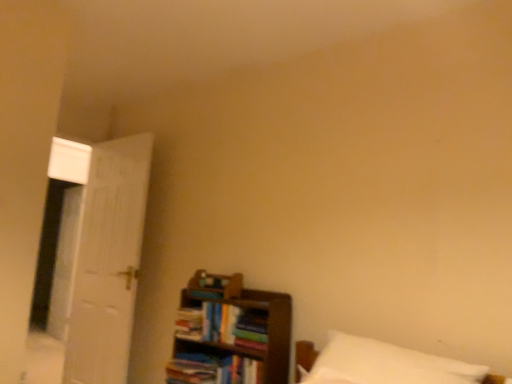
Question: Does hardcover book at center, which is the 1th book in bottom-to-top order, have a greater width compared to white soft pillow at lower right?

Choices:
 (A) no
 (B) yes

Answer: (A)

Question: Considering the relative sizes of hardcover book at center, which is the 1th book in bottom-to-top order, and white soft pillow at lower right in the image provided, is hardcover book at center, which is the 1th book in bottom-to-top order, thinner than white soft pillow at lower right?

Choices:
 (A) yes
 (B) no

Answer: (A)

Question: Can we say hardcover book at center, which is the 1th book in bottom-to-top order, lies outside white soft pillow at lower right?

Choices:
 (A) no
 (B) yes

Answer: (B)

Question: Is hardcover book at center, the 4th book positioned from the top, positioned in front of white soft pillow at lower right?

Choices:
 (A) yes
 (B) no

Answer: (B)

Question: From a real-world perspective, is hardcover book at center, which is the 1th book in bottom-to-top order, positioned under white soft pillow at lower right based on gravity?

Choices:
 (A) no
 (B) yes

Answer: (B)

Question: From the image's perspective, is white soft pillow at lower right above or below hardcover book at center, which is the 1th book in bottom-to-top order?

Choices:
 (A) above
 (B) below

Answer: (A)

Question: Visually, is white soft pillow at lower right positioned to the left or to the right of hardcover book at center, the 4th book positioned from the top?

Choices:
 (A) left
 (B) right

Answer: (B)

Question: Does point (352, 367) appear closer or farther from the camera than point (217, 364)?

Choices:
 (A) farther
 (B) closer

Answer: (B)

Question: Is white soft pillow at lower right taller or shorter than hardcover book at center, which is the 1th book in bottom-to-top order?

Choices:
 (A) short
 (B) tall

Answer: (B)

Question: From the image's perspective, is hardcover book at center, acting as the first book starting from the top, positioned above or below hardcover book at center, the 2th book positioned from the bottom?

Choices:
 (A) below
 (B) above

Answer: (B)

Question: Is hardcover book at center, positioned as the fourth book in bottom-to-top order, situated inside hardcover book at center, the 2th book positioned from the bottom, or outside?

Choices:
 (A) inside
 (B) outside

Answer: (B)

Question: Visually, is hardcover book at center, positioned as the fourth book in bottom-to-top order, positioned to the left or to the right of hardcover book at center, the 2th book positioned from the bottom?

Choices:
 (A) left
 (B) right

Answer: (B)

Question: Is hardcover book at center, acting as the first book starting from the top, in front of or behind hardcover book at center, which appears as the third book when viewed from the top, in the image?

Choices:
 (A) behind
 (B) front

Answer: (A)

Question: From the image's perspective, is white soft pillow at lower right located above or below hardcover book at center, positioned as the fourth book in bottom-to-top order?

Choices:
 (A) below
 (B) above

Answer: (A)

Question: Is white soft pillow at lower right spatially inside hardcover book at center, positioned as the fourth book in bottom-to-top order, or outside of it?

Choices:
 (A) outside
 (B) inside

Answer: (A)